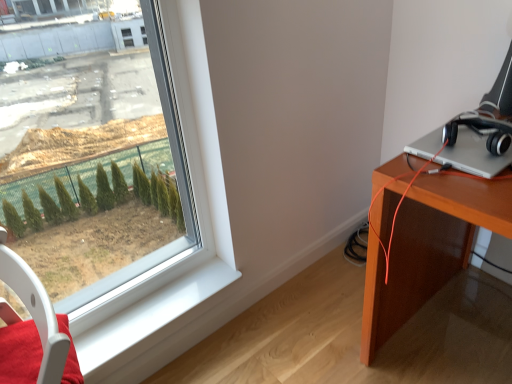
Question: In terms of height, does silver metallic laptop at upper right look taller or shorter compared to white glossy window sill at lower left?

Choices:
 (A) short
 (B) tall

Answer: (B)

Question: Looking at their shapes, would you say silver metallic laptop at upper right is wider or thinner than white glossy window sill at lower left?

Choices:
 (A) wide
 (B) thin

Answer: (A)

Question: Which is farther from the white glossy window sill at lower left?

Choices:
 (A) white plastic swivel chair at lower left
 (B) silver metallic laptop at upper right
 (C) clear glass window at left
 (D) black matte headphones at right

Answer: (D)

Question: Based on their relative distances, which object is farther from the white glossy window sill at lower left?

Choices:
 (A) white plastic swivel chair at lower left
 (B) silver metallic laptop at upper right
 (C) black matte headphones at right
 (D) clear glass window at left

Answer: (C)